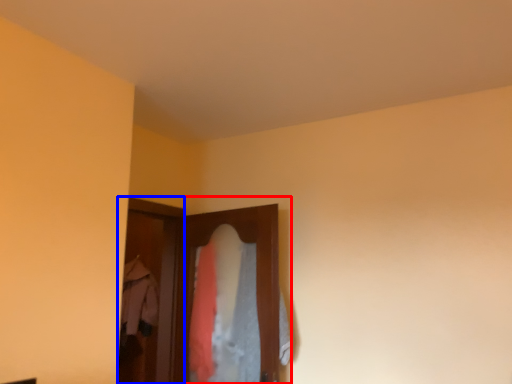
Question: Which point is further to the camera, closet (highlighted by a red box) or screen door (highlighted by a blue box)?

Choices:
 (A) closet
 (B) screen door

Answer: (B)